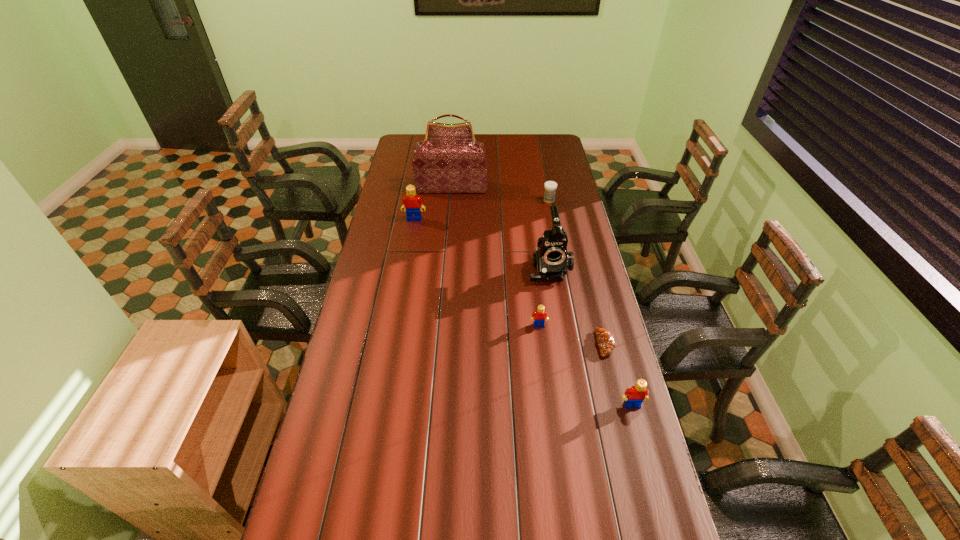
Identify the location of the sixth shortest object. (551, 260).

The width and height of the screenshot is (960, 540). Identify the location of the shortest object. point(605,339).

You are a GUI agent. You are given a task and a screenshot of the screen. Output one action in this format:
    pyautogui.click(x=<x>, y=<y>)
    Task: Click on the crescent roll
    The height and width of the screenshot is (540, 960).
    Given the screenshot: What is the action you would take?
    pyautogui.click(x=605, y=339)

Find the location of `vacant space located 0.260m on the front-facing side of the farthest Lego`. vacant space located 0.260m on the front-facing side of the farthest Lego is located at coordinates (407, 261).

I want to click on free space located 0.170m on the front-facing side of the third nearest object, so click(544, 369).

Identify the location of vacant position located 0.060m on the front-facing side of the rightmost Lego. point(638,429).

The height and width of the screenshot is (540, 960). Identify the location of free space located on the front-facing side of the tallest object. (447, 240).

Find the location of `free point located 0.390m on the back of the medicine`. free point located 0.390m on the back of the medicine is located at coordinates (540, 157).

This screenshot has height=540, width=960. Identify the location of vacant region located 0.330m on the lens mount of the sixth shortest object. coord(564,357).

This screenshot has width=960, height=540. I want to click on free spot located 0.370m on the left of the shortest object, so click(485, 344).